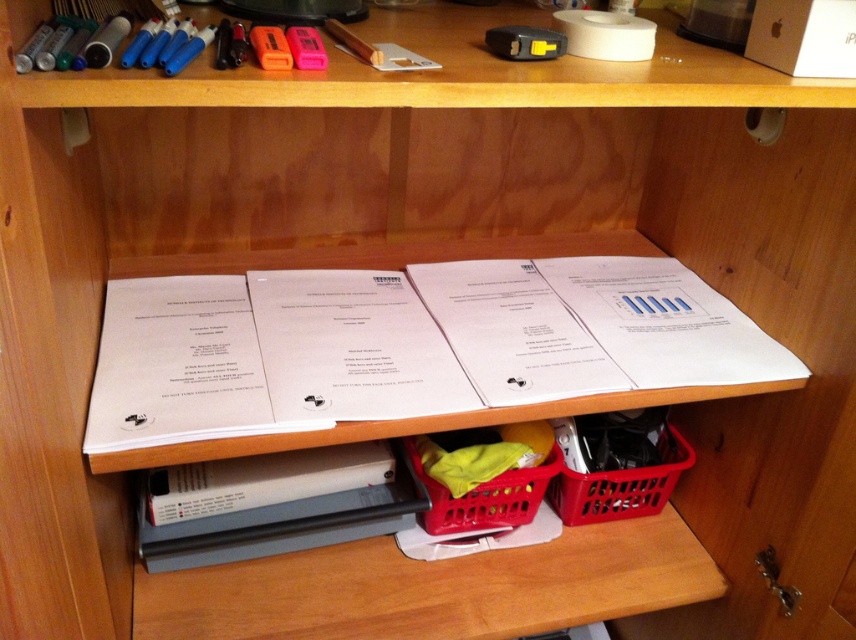
Question: Is black plastic file at lower center bigger than red plastic basket at lower center?

Choices:
 (A) yes
 (B) no

Answer: (A)

Question: Does black plastic file at lower center come behind red plastic basket at lower center?

Choices:
 (A) no
 (B) yes

Answer: (A)

Question: Which point is farther from the camera taking this photo?

Choices:
 (A) (535, 579)
 (B) (539, 486)
 (C) (640, 490)
 (D) (317, 529)

Answer: (C)

Question: Is red plastic basket at lower center thinner than red plastic basket at center?

Choices:
 (A) yes
 (B) no

Answer: (A)

Question: Which object appears farthest from the camera in this image?

Choices:
 (A) red plastic basket at lower center
 (B) wooden shelf at lower center
 (C) black plastic file at lower center
 (D) red plastic basket at center

Answer: (A)

Question: Which is nearer to the red plastic basket at center?

Choices:
 (A) wooden shelf at lower center
 (B) black plastic file at lower center

Answer: (A)